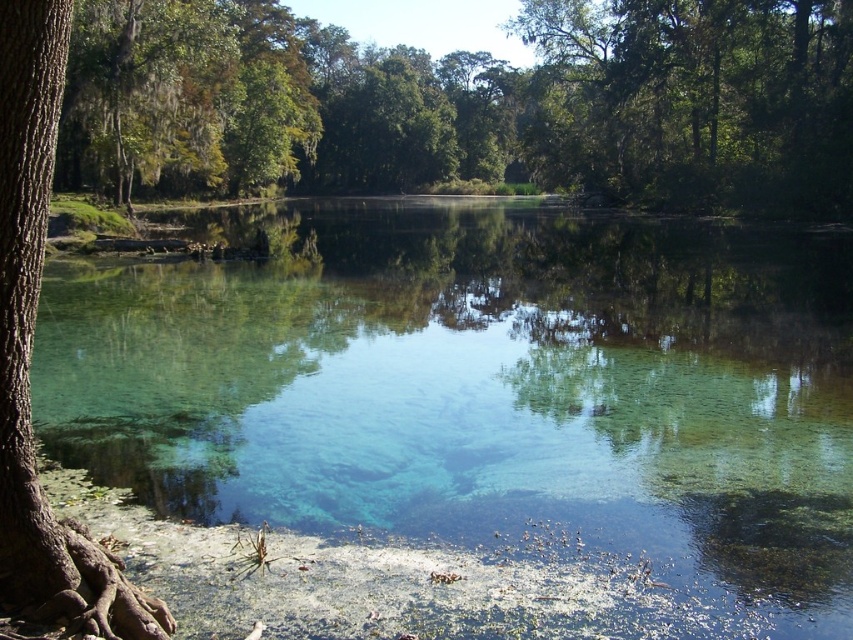
Which of these two, clear water at center or green leafy tree at upper center, stands shorter?

With less height is clear water at center.

Which is behind, point (152, 406) or point (634, 157)?

Point (634, 157)

Where is `clear water at center`? clear water at center is located at coordinates (468, 422).

Can you confirm if clear water at center is positioned to the left of green leafy tree at upper right?

Correct, you'll find clear water at center to the left of green leafy tree at upper right.

Can you confirm if clear water at center is taller than green leafy tree at upper right?

No.

Does point (368, 572) come behind point (635, 67)?

No.

Identify the location of clear water at center. (468, 422).

Which is more to the right, green leafy tree at upper center or brown rough bark tree at left?

brown rough bark tree at left is more to the right.

Between point (219, 173) and point (28, 138), which one is positioned behind?

The point (219, 173) is more distant.

This screenshot has height=640, width=853. Describe the element at coordinates (469, 104) in the screenshot. I see `green leafy tree at upper center` at that location.

The image size is (853, 640). What are the coordinates of `green leafy tree at upper center` in the screenshot? It's located at (469, 104).